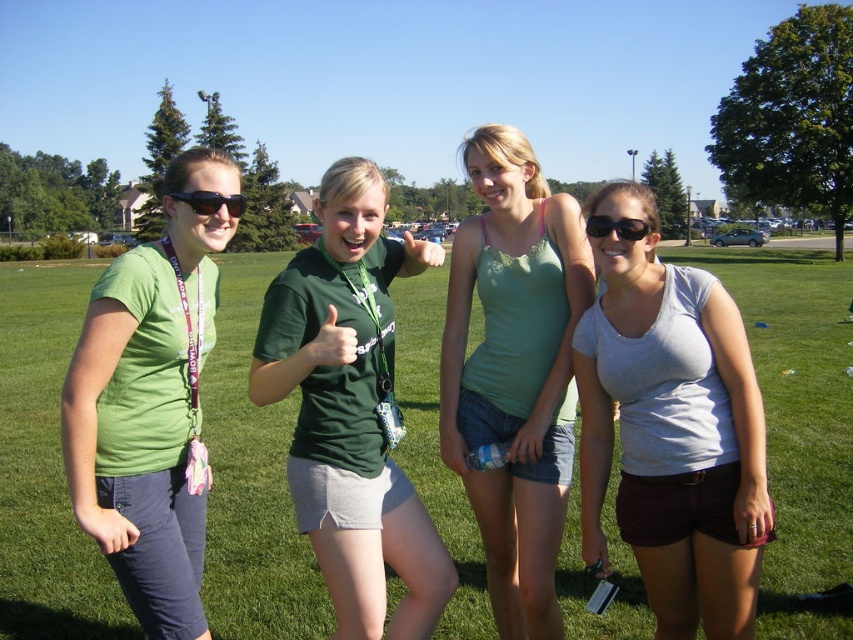
From the picture: You are a photographer trying to capture a group photo of the gray cotton tank top at center and the green lace tank top at center. Since you want to ensure both are clearly visible, which one should you focus on first?

You should focus on the gray cotton tank top at center first because it is in front of the green lace tank top at center, so focusing on it will ensure both are in focus.

You are standing at the origin point of the image. You see a green fabric shirt at center at point [350,410]. Is the green fabric shirt at center located to the left or right of the origin point?

The green fabric shirt at center is located at point [350,410], which is to the right of the origin point.

You are a photographer taking a group photo of the gray cotton tank top at center and the green lace tank top at center. Which one should you focus on first if you want to capture both clearly?

The gray cotton tank top at center is smaller than the green lace tank top at center, so you should focus on the gray cotton tank top at center first to ensure it is in clear focus before adjusting for the larger one.